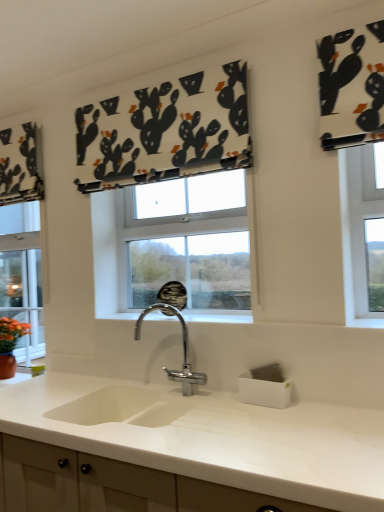
Question: Does white matte countertop at center have a larger size compared to black printed fabric at upper center?

Choices:
 (A) no
 (B) yes

Answer: (B)

Question: Is white matte countertop at center placed right next to black printed fabric at upper center?

Choices:
 (A) no
 (B) yes

Answer: (A)

Question: Is white matte countertop at center at the right side of black printed fabric at upper center?

Choices:
 (A) yes
 (B) no

Answer: (A)

Question: From the image's perspective, is white matte countertop at center over black printed fabric at upper center?

Choices:
 (A) no
 (B) yes

Answer: (A)

Question: Can you confirm if white matte countertop at center is shorter than black printed fabric at upper center?

Choices:
 (A) yes
 (B) no

Answer: (B)

Question: Relative to white matte countertop at center, is chrome metallic faucet at center in front or behind?

Choices:
 (A) behind
 (B) front

Answer: (A)

Question: Visually, is chrome metallic faucet at center positioned to the left or to the right of white matte countertop at center?

Choices:
 (A) right
 (B) left

Answer: (A)

Question: Which is correct: chrome metallic faucet at center is inside white matte countertop at center, or outside of it?

Choices:
 (A) inside
 (B) outside

Answer: (B)

Question: Is chrome metallic faucet at center wider or thinner than white matte countertop at center?

Choices:
 (A) thin
 (B) wide

Answer: (A)

Question: In terms of width, does black printed fabric at upper center look wider or thinner when compared to white matte countertop at center?

Choices:
 (A) wide
 (B) thin

Answer: (B)

Question: From their relative heights in the image, would you say black printed fabric at upper center is taller or shorter than white matte countertop at center?

Choices:
 (A) tall
 (B) short

Answer: (B)

Question: Is black printed fabric at upper center spatially inside white matte countertop at center, or outside of it?

Choices:
 (A) inside
 (B) outside

Answer: (B)

Question: From a real-world perspective, is black printed fabric at upper center positioned above or below white matte countertop at center?

Choices:
 (A) below
 (B) above

Answer: (B)

Question: Considering their positions, is white matte countertop at center located in front of or behind chrome metallic faucet at center?

Choices:
 (A) front
 (B) behind

Answer: (A)

Question: Considering the positions of white matte countertop at center and chrome metallic faucet at center in the image, is white matte countertop at center wider or thinner than chrome metallic faucet at center?

Choices:
 (A) thin
 (B) wide

Answer: (B)